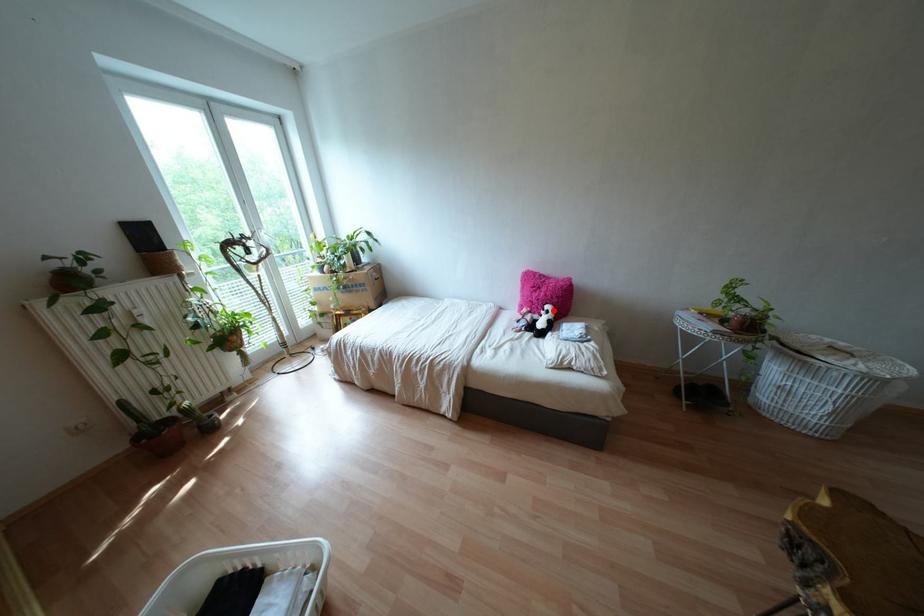
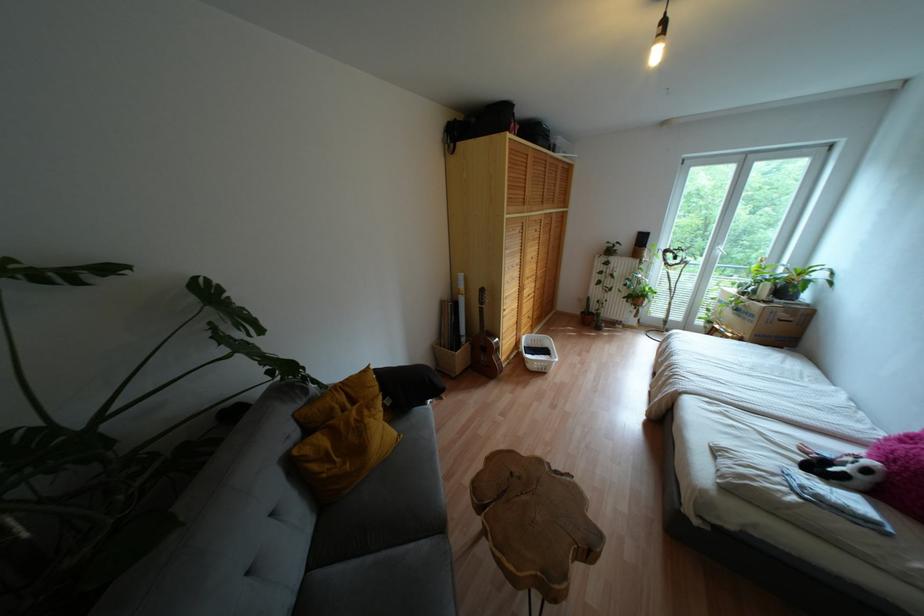
The point at the highlighted location is marked in the first image. Where is the corresponding point in the second image?

(867, 471)